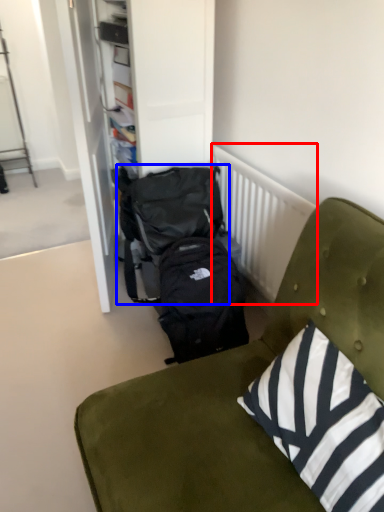
Question: Which point is further to the camera, radiator (highlighted by a red box) or backpack (highlighted by a blue box)?

Choices:
 (A) radiator
 (B) backpack

Answer: (B)